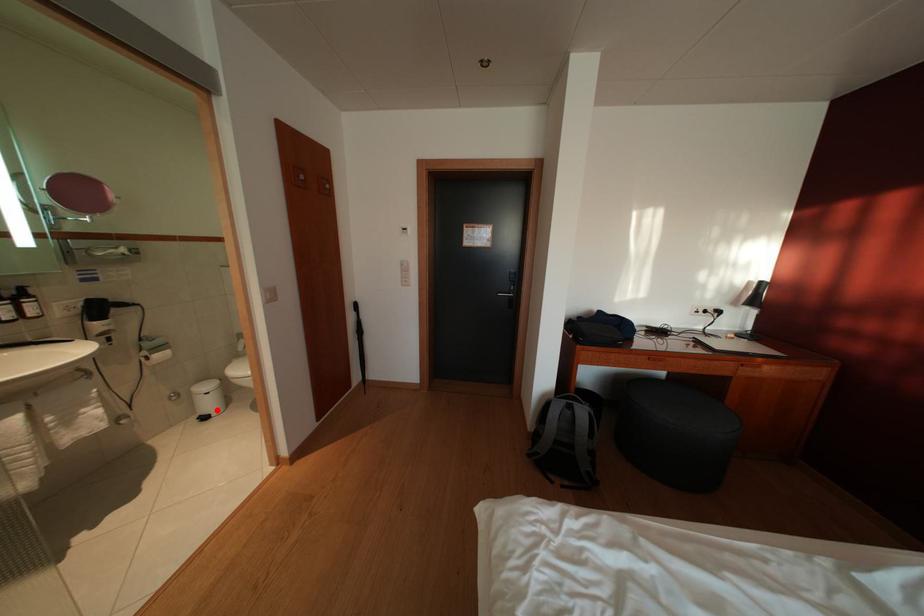
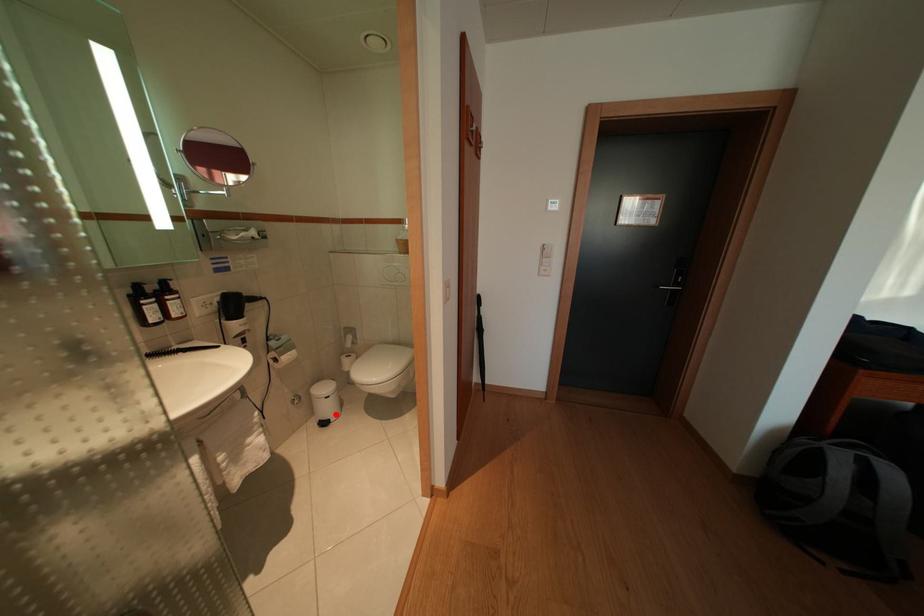
I am providing you with two images of the same scene from different viewpoints. A red point is marked on the first image and another point is marked on the second image. Is the marked point in image1 the same physical position as the marked point in image2?

Yes